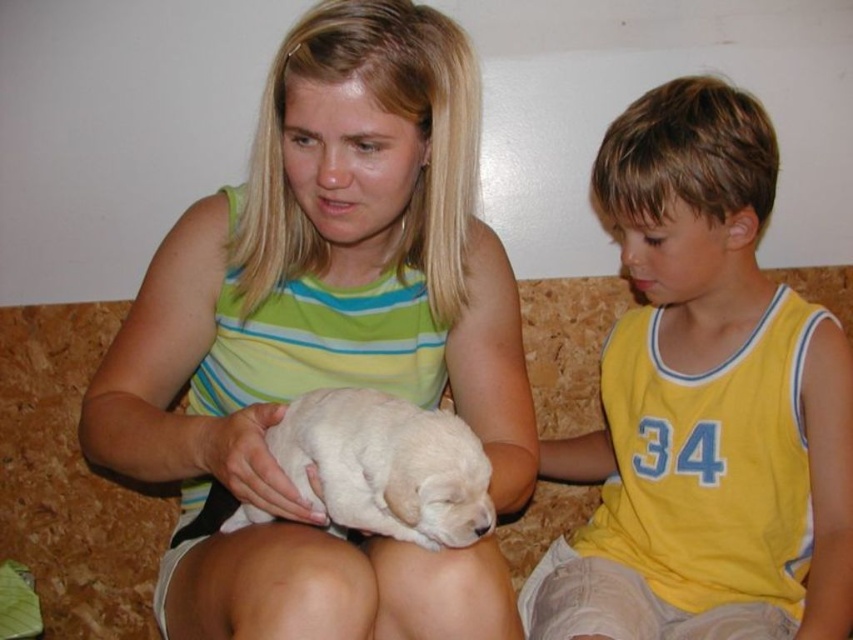
You are a photographer taking a picture of the scene. The camera focuses on the white soft fur at center. Where is the focus point located in terms of coordinates?

The focus point is at coordinates (328, 336).

You are a photographer taking a picture of two people sitting on a couch. You notice the white soft fur at center and the yellow jersey at right. Which item is covering part of the other?

The white soft fur at center is positioned over the yellow jersey at right, so it is covering part of it.

You are a delivery robot that needs to place a small package between the white soft fur at center and the white fur puppy at center. Can you fit the package there if it measures 6 inches in length?

The distance between the white soft fur at center and the white fur puppy at center is 6.08 inches. Since the package is 6 inches long, it can fit in the space between them.